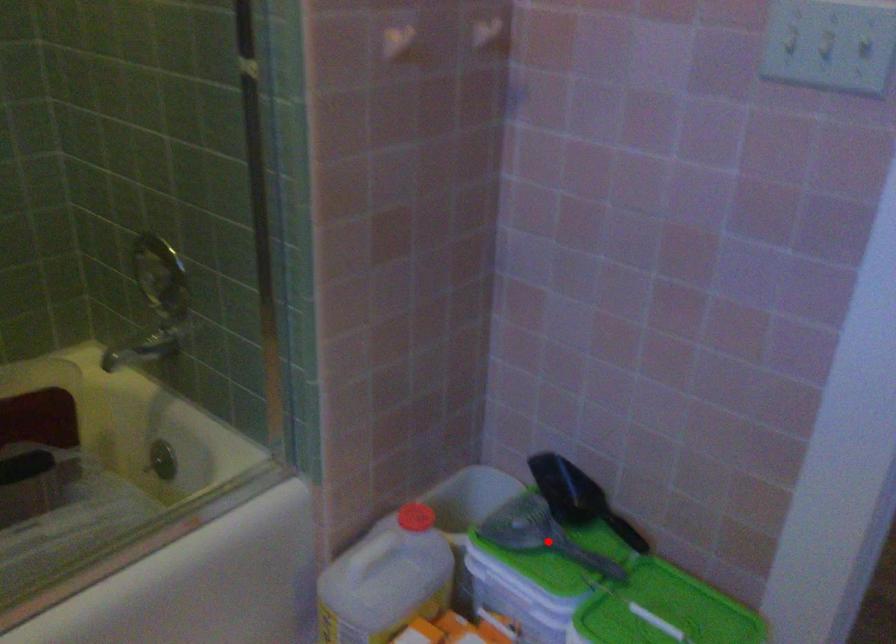
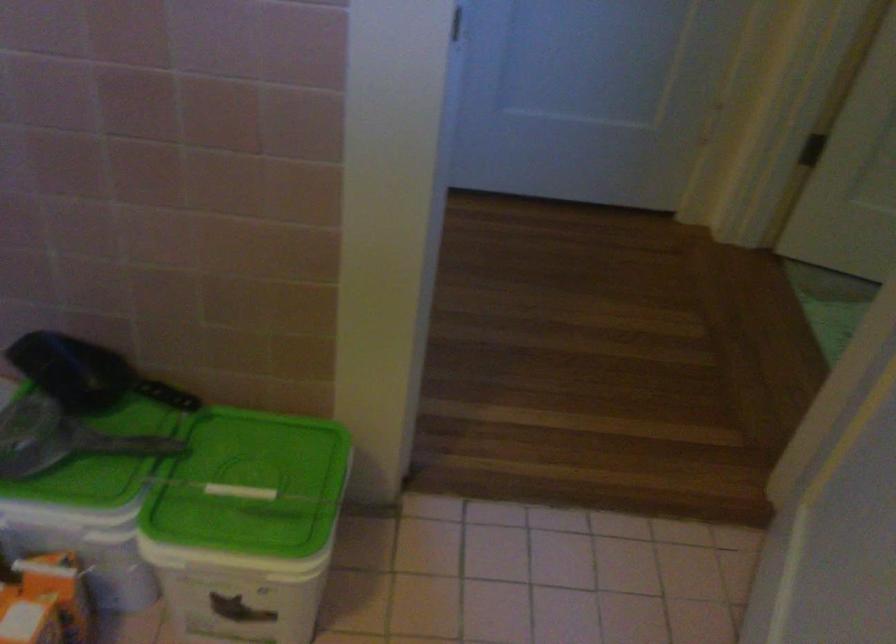
Question: I am providing you with two images of the same scene from different viewpoints. Given a red point in image1, look at the same physical point in image2. Is it:

Choices:
 (A) Closer to the viewpoint
 (B) Farther from the viewpoint

Answer: (A)